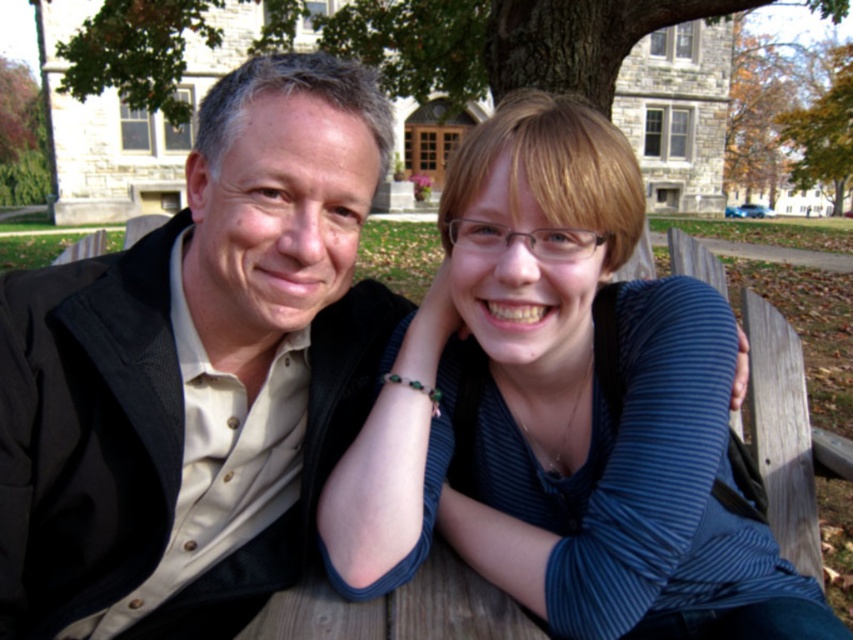
Question: Can you confirm if matte black jacket at left is positioned above blue striped shirt at center?

Choices:
 (A) no
 (B) yes

Answer: (B)

Question: Does matte black jacket at left appear over blue striped shirt at center?

Choices:
 (A) no
 (B) yes

Answer: (B)

Question: Among these points, which one is nearest to the camera?

Choices:
 (A) (325, 388)
 (B) (556, 230)

Answer: (B)

Question: Which point is farther to the camera?

Choices:
 (A) matte black jacket at left
 (B) blue striped shirt at center

Answer: (A)

Question: Does matte black jacket at left appear on the left side of blue striped shirt at center?

Choices:
 (A) yes
 (B) no

Answer: (A)